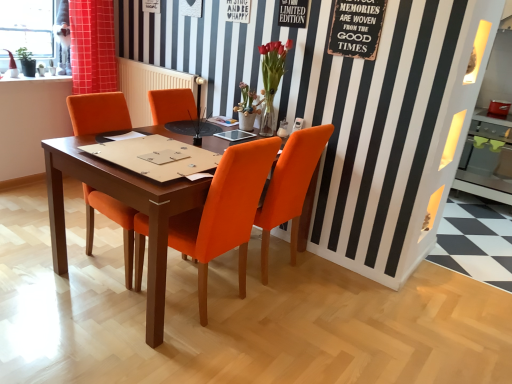
Question: Is rustic wood signboard at upper right far away from matte orange vase at center, which appears as the 2th flower when viewed from the right?

Choices:
 (A) no
 (B) yes

Answer: (A)

Question: Can you confirm if rustic wood signboard at upper right is bigger than matte orange vase at center, which appears as the 2th flower when viewed from the right?

Choices:
 (A) yes
 (B) no

Answer: (B)

Question: Is rustic wood signboard at upper right at the left side of matte orange vase at center, which ranks as the first flower in left-to-right order?

Choices:
 (A) yes
 (B) no

Answer: (B)

Question: Can you confirm if rustic wood signboard at upper right is shorter than matte orange vase at center, which ranks as the first flower in left-to-right order?

Choices:
 (A) yes
 (B) no

Answer: (B)

Question: From the image's perspective, is rustic wood signboard at upper right on top of matte orange vase at center, which appears as the 2th flower when viewed from the right?

Choices:
 (A) yes
 (B) no

Answer: (A)

Question: Is matte orange vase at center, which appears as the 2th flower when viewed from the right, inside or outside of rustic wood signboard at upper right?

Choices:
 (A) outside
 (B) inside

Answer: (A)

Question: Is matte orange vase at center, which appears as the 2th flower when viewed from the right, taller or shorter than rustic wood signboard at upper right?

Choices:
 (A) tall
 (B) short

Answer: (B)

Question: From the image's perspective, is matte orange vase at center, which ranks as the first flower in left-to-right order, located above or below rustic wood signboard at upper right?

Choices:
 (A) above
 (B) below

Answer: (B)

Question: In terms of size, does matte orange vase at center, which ranks as the first flower in left-to-right order, appear bigger or smaller than rustic wood signboard at upper right?

Choices:
 (A) big
 (B) small

Answer: (A)

Question: Would you say matte orange vase at center, which appears as the 2th flower when viewed from the right, is inside or outside orange fabric chair at center, positioned as the 2th chair in left-to-right order?

Choices:
 (A) inside
 (B) outside

Answer: (B)

Question: Is point (245, 84) closer or farther from the camera than point (226, 249)?

Choices:
 (A) closer
 (B) farther

Answer: (B)

Question: Is matte orange vase at center, which appears as the 2th flower when viewed from the right, in front of or behind orange fabric chair at center, positioned as the 2th chair in left-to-right order, in the image?

Choices:
 (A) front
 (B) behind

Answer: (B)

Question: In terms of height, does matte orange vase at center, which appears as the 2th flower when viewed from the right, look taller or shorter compared to orange fabric chair at center, the 2th chair from the right?

Choices:
 (A) short
 (B) tall

Answer: (A)

Question: Visually, is rustic wood signboard at upper right positioned to the left or to the right of wooden table at center?

Choices:
 (A) left
 (B) right

Answer: (B)

Question: Looking at their shapes, would you say rustic wood signboard at upper right is wider or thinner than wooden table at center?

Choices:
 (A) thin
 (B) wide

Answer: (A)